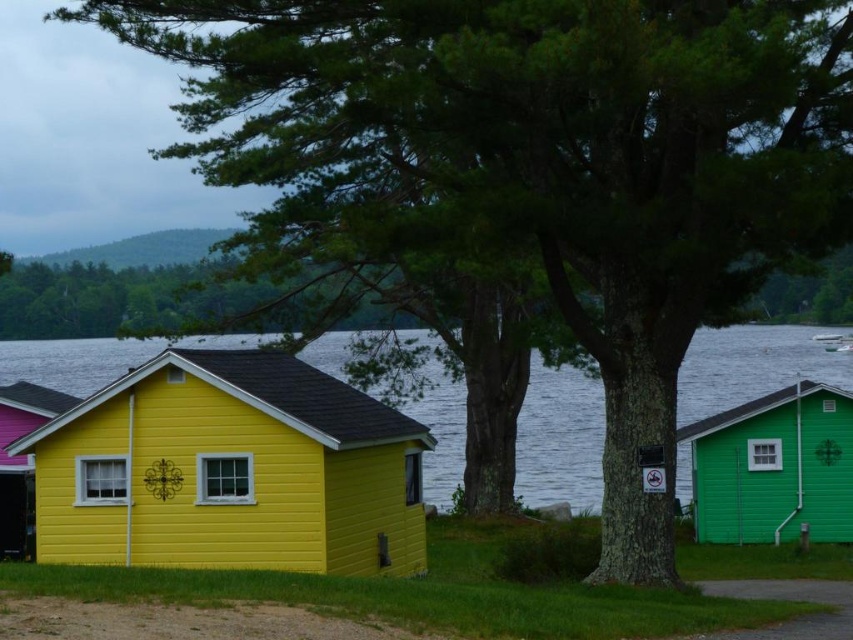
You are standing at the point where the dirt path meets the yellow house. Looking towards the lake, you see a point marked at coordinates (560, 438). What is located at this point?

The transparent water at lower center is located at the point marked (560, 438).

You are standing at the yellow house and want to take a photo of the two points mentioned. Which point, point (45, 468) or point (601, 444), will appear larger in your camera view?

Point (45, 468) will appear larger in the camera view because it is closer to the camera than point (601, 444).

You are planning to build a dock extending from the yellow wood cabin at center towards the transparent water at lower center. Based on the scene description, will the dock need to slope upwards or downwards to reach the water surface?

The yellow wood cabin at center is shorter than transparent water at lower center, so the dock will need to slope upwards to reach the water surface.